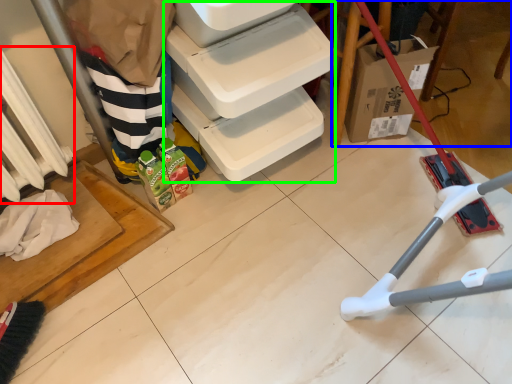
Question: Estimate the real-world distances between objects in this image. Which object is farther from radiator (highlighted by a red box), furniture (highlighted by a blue box) or shelf (highlighted by a green box)?

Choices:
 (A) furniture
 (B) shelf

Answer: (A)